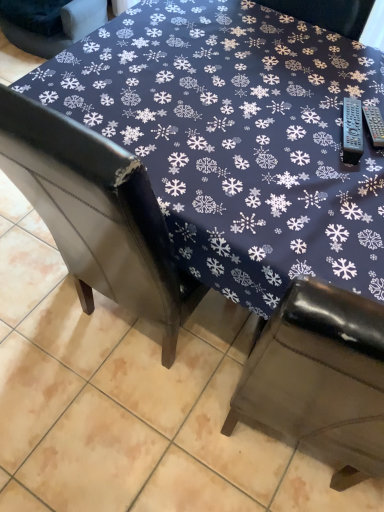
Question: Is point click(249, 304) closer or farther from the camera than point click(29, 32)?

Choices:
 (A) farther
 (B) closer

Answer: (B)

Question: Would you say dark blue fabric tablecloth at center is to the left or to the right of dark leather chair at upper left in the picture?

Choices:
 (A) left
 (B) right

Answer: (B)

Question: Is dark blue fabric tablecloth at center in front of or behind dark leather chair at upper left in the image?

Choices:
 (A) behind
 (B) front

Answer: (B)

Question: In the image, is dark leather chair at upper left positioned in front of or behind dark blue fabric tablecloth at center?

Choices:
 (A) front
 (B) behind

Answer: (B)

Question: In terms of height, does dark leather chair at upper left look taller or shorter compared to dark blue fabric tablecloth at center?

Choices:
 (A) short
 (B) tall

Answer: (A)

Question: Is dark leather chair at upper left spatially inside dark blue fabric tablecloth at center, or outside of it?

Choices:
 (A) outside
 (B) inside

Answer: (A)

Question: Based on their positions, is dark leather chair at upper left located to the left or right of dark blue fabric tablecloth at center?

Choices:
 (A) left
 (B) right

Answer: (A)